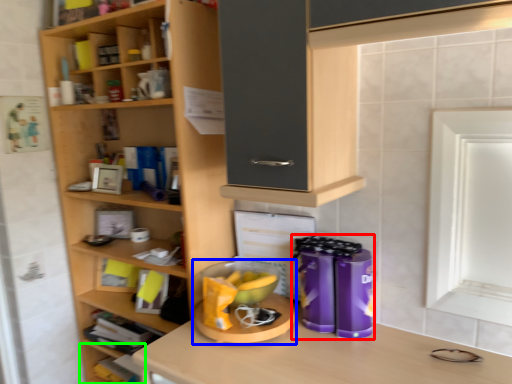
Question: Based on their relative distances, which object is farther from appliance (highlighted by a red box)? Choose from appliance (highlighted by a blue box) and shelf (highlighted by a green box).

Choices:
 (A) appliance
 (B) shelf

Answer: (B)